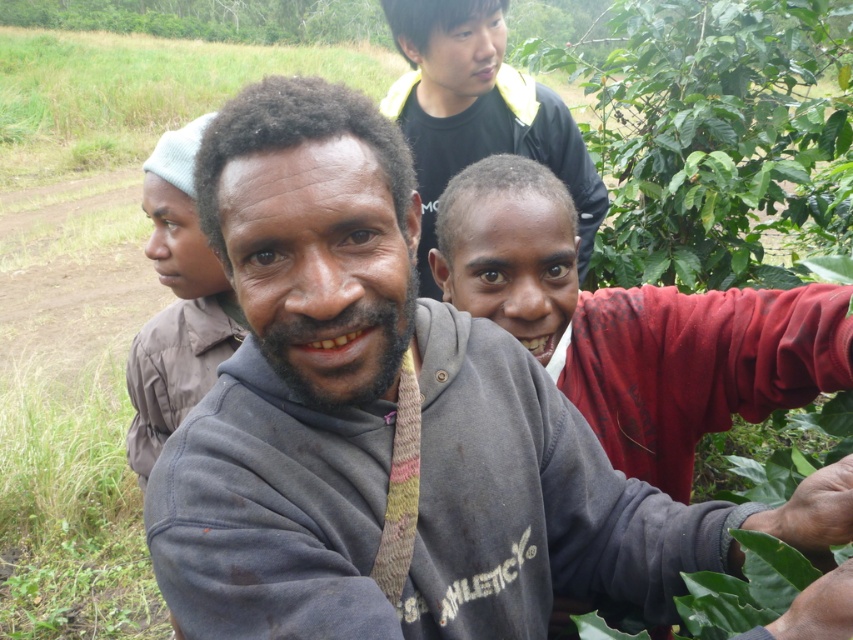
Does gray cotton hoodie at lower right have a lesser height compared to brown cotton shirt at center?

Correct, gray cotton hoodie at lower right is not as tall as brown cotton shirt at center.

In the scene shown: Is gray cotton hoodie at lower right to the left of brown cotton shirt at center from the viewer's perspective?

Incorrect, gray cotton hoodie at lower right is not on the left side of brown cotton shirt at center.

The height and width of the screenshot is (640, 853). Identify the location of gray cotton hoodie at lower right. (630, 324).

Can you confirm if gray cotton hoodie at lower right is shorter than black matte shirt at upper center?

Yes, gray cotton hoodie at lower right is shorter than black matte shirt at upper center.

Measure the distance between gray cotton hoodie at lower right and camera.

gray cotton hoodie at lower right and camera are 1.04 meters apart.

You are a GUI agent. You are given a task and a screenshot of the screen. Output one action in this format:
    pyautogui.click(x=<x>, y=<y>)
    Task: Click on the gray cotton hoodie at lower right
    This screenshot has width=853, height=640.
    Given the screenshot: What is the action you would take?
    pyautogui.click(x=630, y=324)

Which is more to the right, gray sweatshirt at center or black matte shirt at upper center?

gray sweatshirt at center is more to the right.

Does point (294, 122) lie behind point (537, 150)?

No, it is in front of (537, 150).

Is point (264, 572) behind point (601, 212)?

That is False.

Where is `gray sweatshirt at center`? Image resolution: width=853 pixels, height=640 pixels. gray sweatshirt at center is located at coordinates (393, 422).